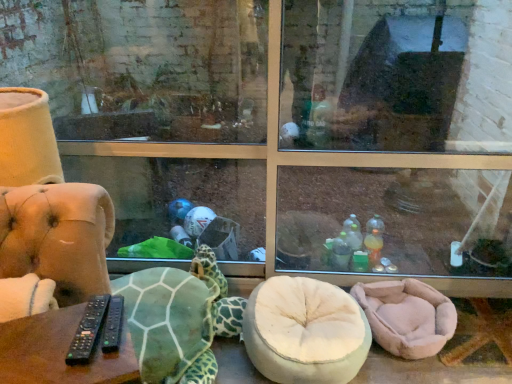
Question: Does pink plush bean bag at lower right appear on the right side of black plastic remotes at lower left?

Choices:
 (A) no
 (B) yes

Answer: (B)

Question: From the image's perspective, is pink plush bean bag at lower right located beneath black plastic remotes at lower left?

Choices:
 (A) yes
 (B) no

Answer: (A)

Question: From the image's perspective, is pink plush bean bag at lower right located above black plastic remotes at lower left?

Choices:
 (A) yes
 (B) no

Answer: (B)

Question: Considering the relative positions of pink plush bean bag at lower right and black plastic remotes at lower left in the image provided, is pink plush bean bag at lower right to the left of black plastic remotes at lower left from the viewer's perspective?

Choices:
 (A) no
 (B) yes

Answer: (A)

Question: Is black plastic remotes at lower left surrounded by pink plush bean bag at lower right?

Choices:
 (A) no
 (B) yes

Answer: (A)

Question: Could you tell me if pink plush bean bag at lower right is turned towards black plastic remotes at lower left?

Choices:
 (A) no
 (B) yes

Answer: (A)

Question: Is pink plush bean bag at lower right inside green textured fabric tortoise at lower left?

Choices:
 (A) yes
 (B) no

Answer: (B)

Question: Is the depth of green textured fabric tortoise at lower left less than that of pink plush bean bag at lower right?

Choices:
 (A) no
 (B) yes

Answer: (B)

Question: Is green textured fabric tortoise at lower left further to the viewer compared to pink plush bean bag at lower right?

Choices:
 (A) no
 (B) yes

Answer: (A)

Question: Considering the relative sizes of green textured fabric tortoise at lower left and pink plush bean bag at lower right in the image provided, is green textured fabric tortoise at lower left taller than pink plush bean bag at lower right?

Choices:
 (A) yes
 (B) no

Answer: (A)

Question: From the image's perspective, is green textured fabric tortoise at lower left on top of pink plush bean bag at lower right?

Choices:
 (A) no
 (B) yes

Answer: (B)

Question: Does green textured fabric tortoise at lower left have a lesser width compared to pink plush bean bag at lower right?

Choices:
 (A) no
 (B) yes

Answer: (A)

Question: Is black plastic remotes at lower left thinner than pink plush bean bag at lower right?

Choices:
 (A) no
 (B) yes

Answer: (B)